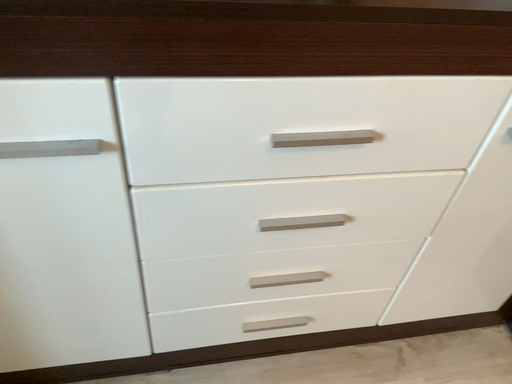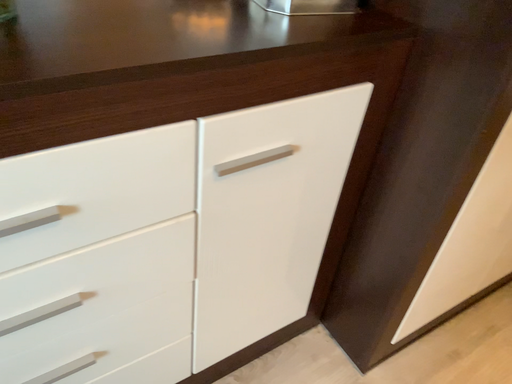
Question: Which way did the camera rotate in the video?

Choices:
 (A) rotated left
 (B) rotated right

Answer: (B)